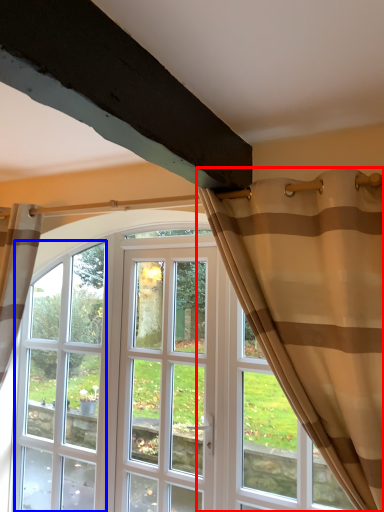
Question: Which of the following is the closest to the observer, curtain (highlighted by a red box) or window (highlighted by a blue box)?

Choices:
 (A) curtain
 (B) window

Answer: (A)